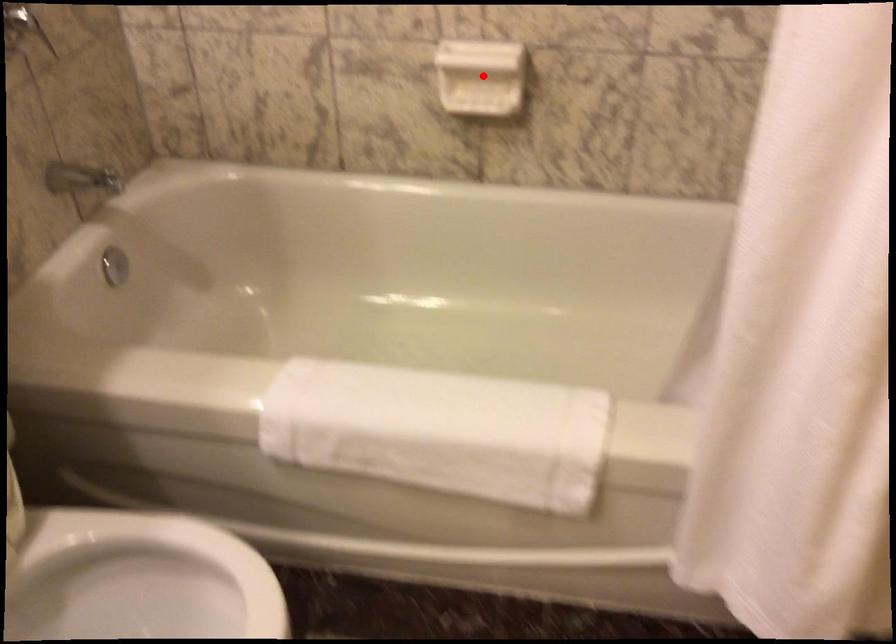
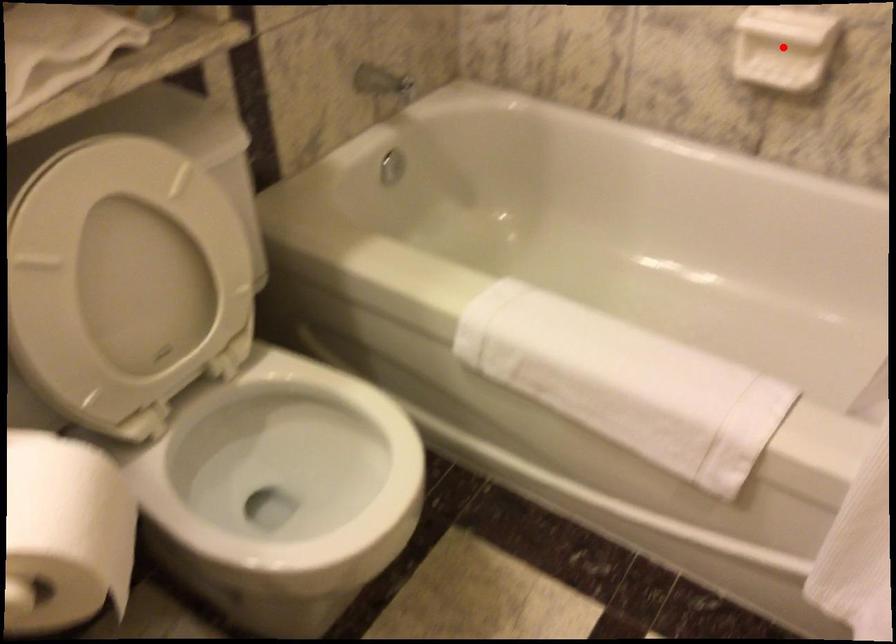
I am providing you with two images of the same scene from different viewpoints. A red point is marked on the first image and another point is marked on the second image. Is the marked point in image1 the same physical position as the marked point in image2?

Yes